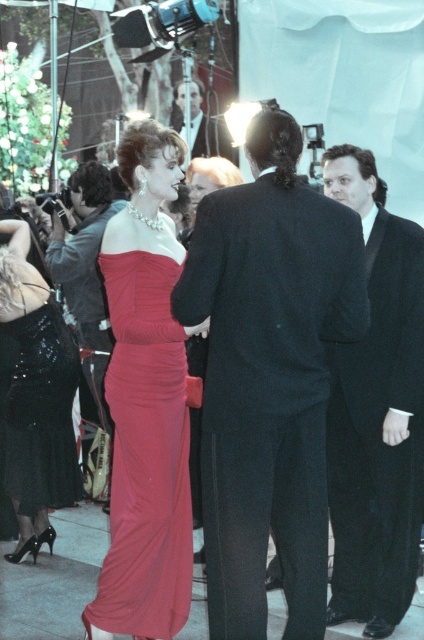
Question: Which is nearer to the smooth black suit at center?

Choices:
 (A) matte red dress at center
 (B) satin black dress at center
 (C) matte black suit at center
 (D) black wool suit at center

Answer: (C)

Question: Which point appears farthest from the camera in this image?

Choices:
 (A) (128, 321)
 (B) (178, 106)
 (C) (203, 349)
 (D) (284, 476)

Answer: (B)

Question: Which object is positioned closest to the satin black dress at center?

Choices:
 (A) matte red dress at center
 (B) smooth black suit at center
 (C) satin red dress at center
 (D) black wool suit at center

Answer: (C)

Question: Can you confirm if satin red dress at center is wider than matte black suit at center?

Choices:
 (A) yes
 (B) no

Answer: (A)

Question: Can you confirm if black satin suit at right is positioned to the right of matte black suit at center?

Choices:
 (A) yes
 (B) no

Answer: (A)

Question: Does black wool suit at center have a smaller size compared to matte black suit at center?

Choices:
 (A) yes
 (B) no

Answer: (A)